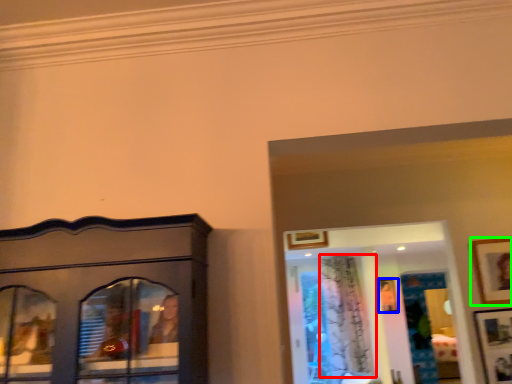
Question: Which object is the closest to the curtain (highlighted by a red box)? Choose among these: picture frame (highlighted by a blue box) or picture frame (highlighted by a green box).

Choices:
 (A) picture frame
 (B) picture frame

Answer: (A)